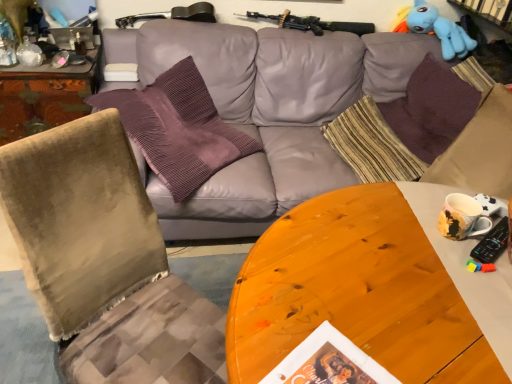
Question: Is purple velvet pillow at upper left, which is the first pillow from left to right, in front of or behind striped fabric pillow at center, which ranks as the second pillow in left-to-right order, in the image?

Choices:
 (A) behind
 (B) front

Answer: (B)

Question: Is purple velvet pillow at upper left, the 4th pillow from the right, spatially inside striped fabric pillow at center, which appears as the third pillow when viewed from the right, or outside of it?

Choices:
 (A) inside
 (B) outside

Answer: (B)

Question: Estimate the real-world distances between objects in this image. Which object is farther from the purple knitted pillow at upper right, arranged as the first pillow when viewed from the right?

Choices:
 (A) striped fabric pillow at center, which ranks as the second pillow in left-to-right order
 (B) velvet green chair at left
 (C) wooden desk at left
 (D) blue plush toy at upper right
 (E) multicolored ceramic mug at right

Answer: (C)

Question: Estimate the real-world distances between objects in this image. Which object is farther from the multicolored ceramic mug at right?

Choices:
 (A) white matte magazine at center
 (B) purple corduroy pillow at upper right, which appears as the second pillow when viewed from the right
 (C) wooden desk at left
 (D) velvet green chair at left
 (E) striped fabric pillow at center, which appears as the third pillow when viewed from the right

Answer: (C)